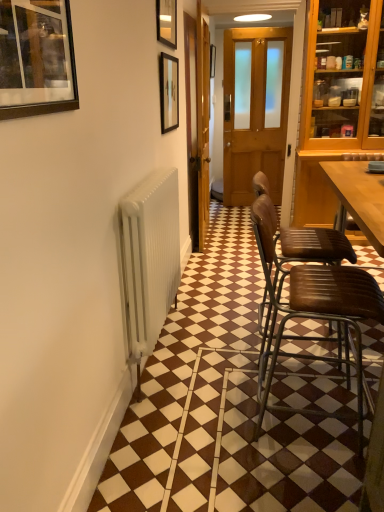
Question: Could you tell me if matte black picture frame at upper center, placed as the third picture frame when sorted from bottom to top, is facing wooden picture frame at center, positioned as the first picture frame in back-to-front order?

Choices:
 (A) yes
 (B) no

Answer: (B)

Question: Can you confirm if matte black picture frame at upper center, marked as the second picture frame in a front-to-back arrangement, is shorter than wooden picture frame at center, acting as the 4th picture frame starting from the front?

Choices:
 (A) yes
 (B) no

Answer: (A)

Question: Is matte black picture frame at upper center, the 3th picture frame viewed from the left, positioned before wooden picture frame at center, which ranks as the fourth picture frame in bottom-to-top order?

Choices:
 (A) no
 (B) yes

Answer: (B)

Question: Is matte black picture frame at upper center, the 2th picture frame when ordered from top to bottom, further to the viewer compared to wooden picture frame at center, which ranks as the fourth picture frame in bottom-to-top order?

Choices:
 (A) yes
 (B) no

Answer: (B)

Question: Is matte black picture frame at upper center, marked as the second picture frame in a front-to-back arrangement, at the right side of wooden picture frame at center, which ranks as the first picture frame in right-to-left order?

Choices:
 (A) yes
 (B) no

Answer: (B)

Question: Considering their positions, is matte black picture frame at upper center, the 2th picture frame when ordered from top to bottom, located in front of or behind wooden door at center?

Choices:
 (A) front
 (B) behind

Answer: (A)

Question: From a real-world perspective, is matte black picture frame at upper center, the second picture frame viewed from the right, physically located above or below wooden door at center?

Choices:
 (A) below
 (B) above

Answer: (B)

Question: In terms of size, does matte black picture frame at upper center, marked as the second picture frame in a front-to-back arrangement, appear bigger or smaller than wooden door at center?

Choices:
 (A) small
 (B) big

Answer: (A)

Question: Visually, is matte black picture frame at upper center, the 3th picture frame viewed from the left, positioned to the left or to the right of wooden door at center?

Choices:
 (A) left
 (B) right

Answer: (A)

Question: Considering the positions of matte black picture frame at upper center, placed as the third picture frame when sorted from bottom to top, and brown leather chair at right, which is the first chair in back-to-front order, in the image, is matte black picture frame at upper center, placed as the third picture frame when sorted from bottom to top, bigger or smaller than brown leather chair at right, which is the first chair in back-to-front order,?

Choices:
 (A) small
 (B) big

Answer: (A)

Question: Would you say matte black picture frame at upper center, the second picture frame viewed from the right, is inside or outside brown leather chair at right, the 2th chair viewed from the front?

Choices:
 (A) outside
 (B) inside

Answer: (A)

Question: Is point [160, 28] positioned closer to the camera than point [316, 230]?

Choices:
 (A) closer
 (B) farther

Answer: (B)

Question: From a real-world perspective, is matte black picture frame at upper center, which appears as the 3th picture frame when viewed from the back, positioned above or below brown leather chair at right, which is the first chair in back-to-front order?

Choices:
 (A) above
 (B) below

Answer: (A)

Question: In terms of size, does brown leather chair at right, marked as the 1th chair in a front-to-back arrangement, appear bigger or smaller than wooden picture frame at center, which ranks as the first picture frame in right-to-left order?

Choices:
 (A) big
 (B) small

Answer: (A)

Question: From their relative heights in the image, would you say brown leather chair at right, which appears as the 2th chair when viewed from the back, is taller or shorter than wooden picture frame at center, positioned as the first picture frame in back-to-front order?

Choices:
 (A) tall
 (B) short

Answer: (A)